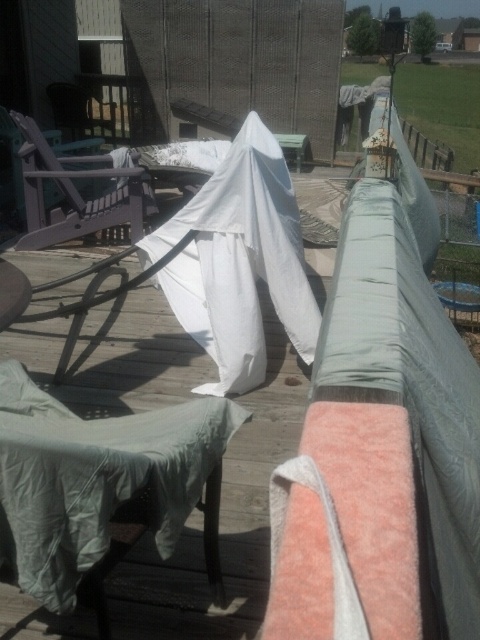
Looking at this image, does green fabric chair at lower left have a greater height compared to white fabric ghost at center?

No.

Is green fabric chair at lower left smaller than white fabric ghost at center?

Yes.

Is point (171, 426) less distant than point (228, 289)?

Yes, it is.

Locate an element on the screen. This screenshot has width=480, height=640. green fabric chair at lower left is located at coordinates (94, 477).

Who is lower down, white fabric ghost at center or matte purple chair at left?

white fabric ghost at center is below.

Describe the element at coordinates (239, 260) in the screenshot. The width and height of the screenshot is (480, 640). I see `white fabric ghost at center` at that location.

Locate an element on the screen. white fabric ghost at center is located at coordinates (239, 260).

You are a GUI agent. You are given a task and a screenshot of the screen. Output one action in this format:
    pyautogui.click(x=<x>, y=<y>)
    Task: Click on the white fabric ghost at center
    
    Given the screenshot: What is the action you would take?
    pyautogui.click(x=239, y=260)

What do you see at coordinates (94, 477) in the screenshot? This screenshot has width=480, height=640. I see `green fabric chair at lower left` at bounding box center [94, 477].

Does green fabric chair at lower left have a lesser width compared to matte purple chair at left?

Yes.

What do you see at coordinates (94, 477) in the screenshot? I see `green fabric chair at lower left` at bounding box center [94, 477].

You are a GUI agent. You are given a task and a screenshot of the screen. Output one action in this format:
    pyautogui.click(x=<x>, y=<y>)
    Task: Click on the green fabric chair at lower left
    
    Given the screenshot: What is the action you would take?
    pyautogui.click(x=94, y=477)